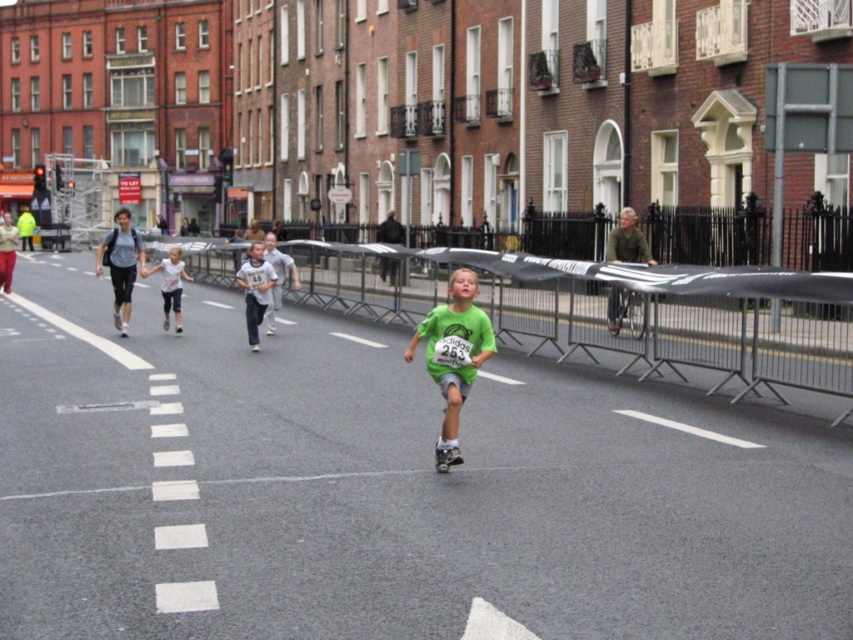
Where is the green matte shirt at center located in the image?

The green matte shirt at center is located at point coordinates of (453,355).

You are a photographer standing on the sidewalk. You want to take a photo of the green matte shirt at center and the green textured shirt at center. Which one is positioned lower in the frame?

The green matte shirt at center is located below green textured shirt at center, so the green matte shirt at center is positioned lower in the frame.

You are a photographer standing at the starting line of the race. You want to take a photo that includes both the green textured shirt at center and the light gray cotton shirt at center. If your camera has a maximum focus range of 5 meters, will you be able to capture both in focus?

The green textured shirt at center is 5.64 meters from the light gray cotton shirt at center. Since the distance between them exceeds the camera focus range of 5 meters, the camera cannot keep both in focus simultaneously.